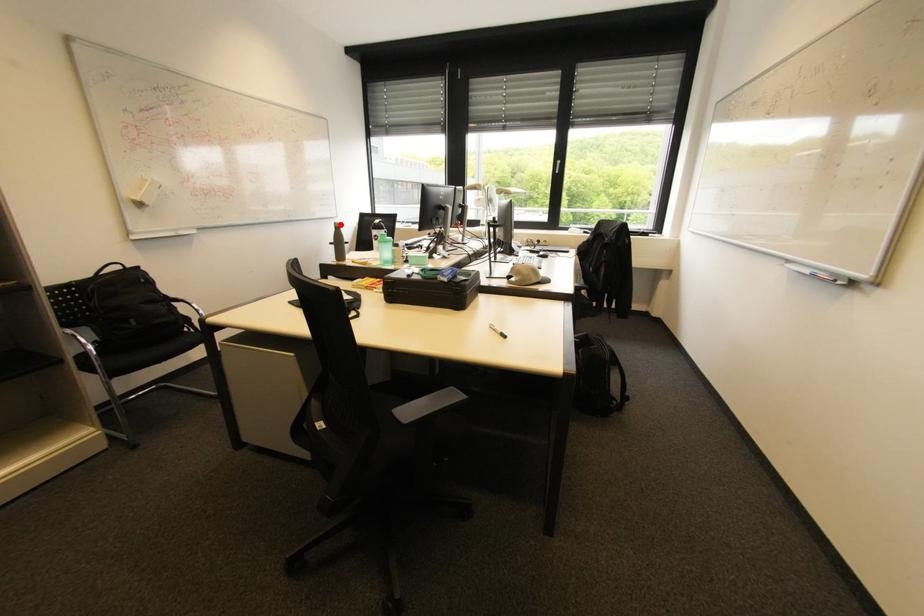
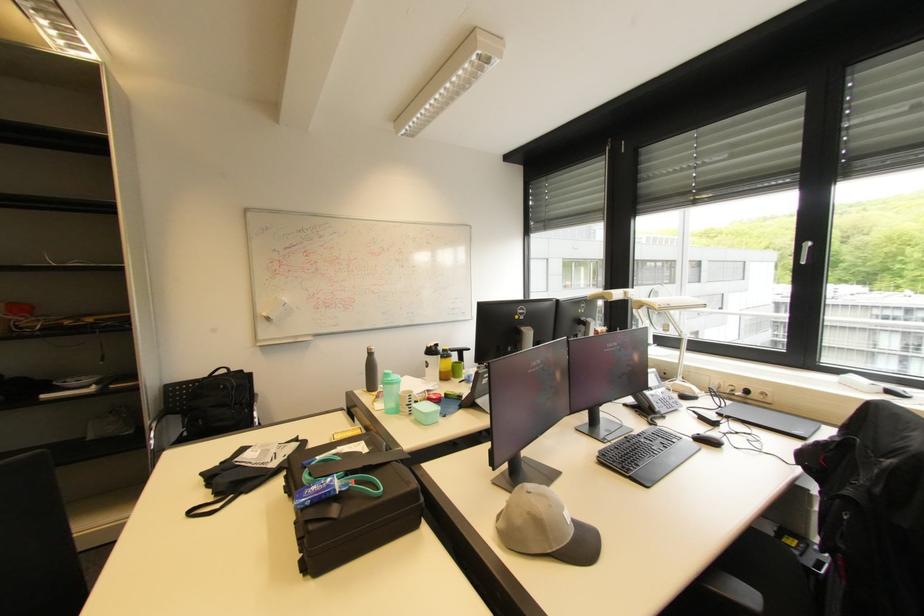
Question: I am providing you with two images of the same scene from different viewpoints. A red point is shown in image1. For the corresponding object point in image2, is it positioned nearer or farther from the camera?

Choices:
 (A) Nearer
 (B) Farther

Answer: (B)